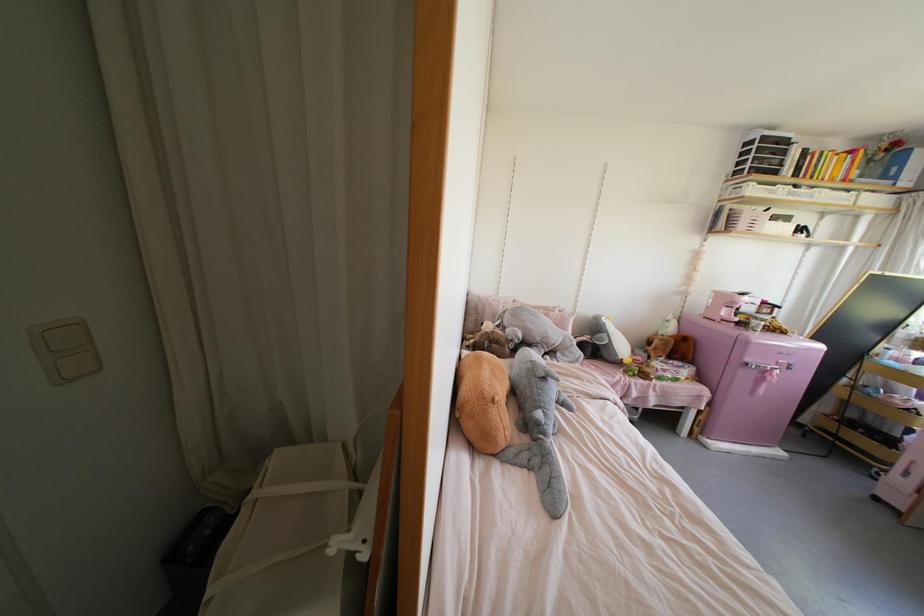
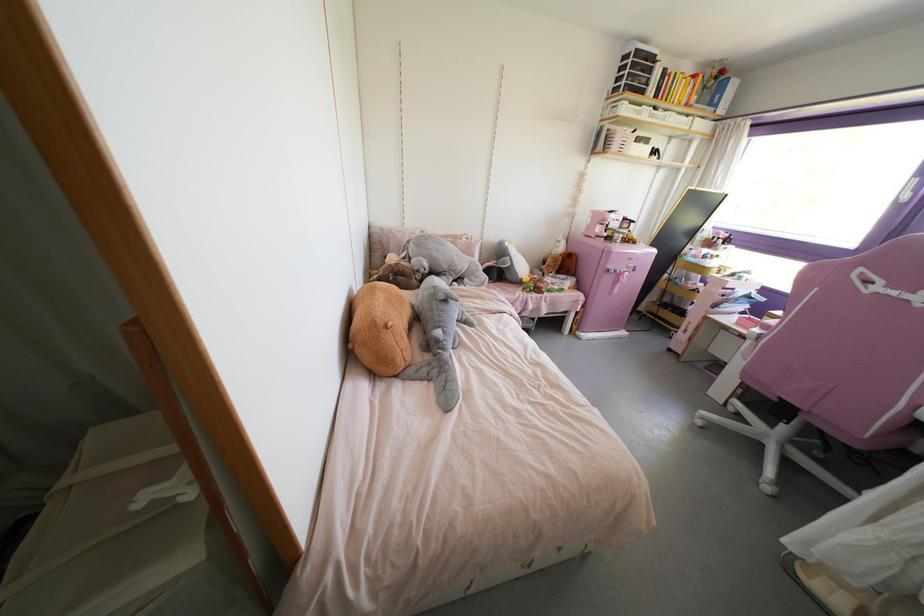
The point at (624,361) is marked in the first image. Where is the corresponding point in the second image?

(523, 280)